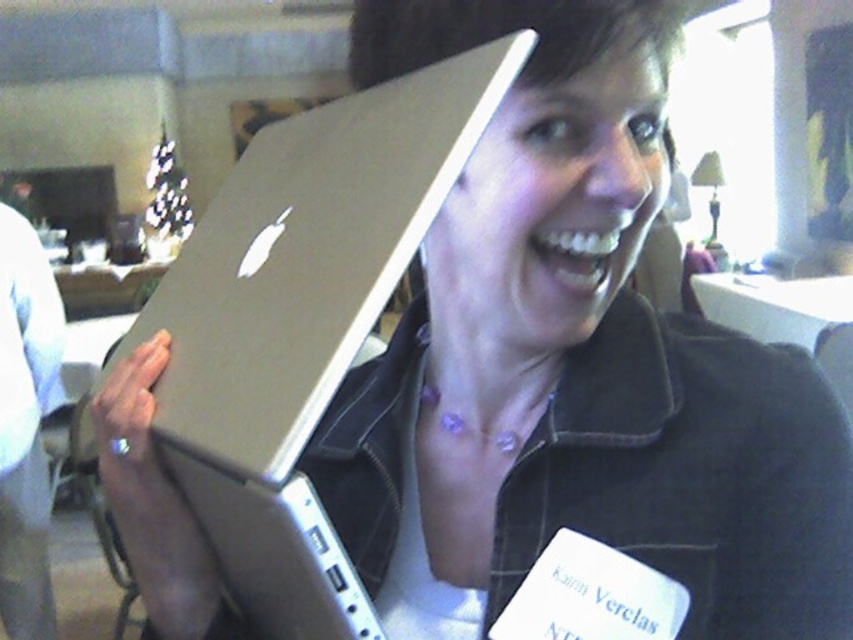
Does silver metallic laptop at center appear under brushed metal laptop at left?

No, silver metallic laptop at center is not below brushed metal laptop at left.

Consider the image. Does silver metallic laptop at center come in front of brushed metal laptop at left?

Yes, it is in front of brushed metal laptop at left.

This screenshot has height=640, width=853. What are the coordinates of `silver metallic laptop at center` in the screenshot? It's located at (305, 266).

Image resolution: width=853 pixels, height=640 pixels. Identify the location of silver metallic laptop at center. [x=305, y=266].